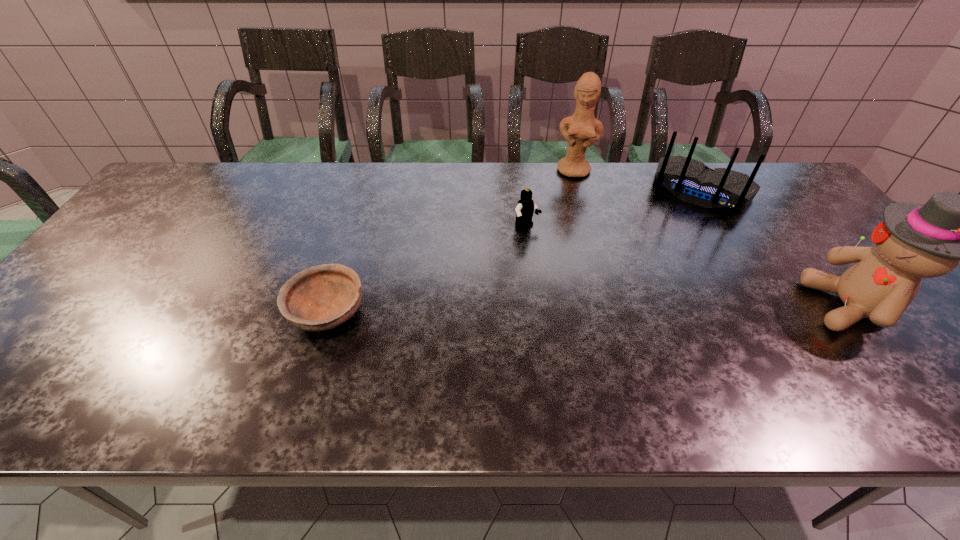
Identify the location of free spot between the fourth tallest object and the leftmost object. (427, 271).

Locate an element on the screen. unoccupied area between the rag_doll and the fourth object from right to left is located at coordinates (688, 267).

Image resolution: width=960 pixels, height=540 pixels. Find the location of `free area in between the rag_doll and the leftmost object`. free area in between the rag_doll and the leftmost object is located at coordinates pyautogui.click(x=588, y=309).

The height and width of the screenshot is (540, 960). Identify the location of free point between the rag_doll and the fourth tallest object. 688,267.

You are a GUI agent. You are given a task and a screenshot of the screen. Output one action in this format:
    pyautogui.click(x=<x>, y=<y>)
    Task: Click on the third closest object to the shortest object
    Image resolution: width=960 pixels, height=540 pixels.
    Given the screenshot: What is the action you would take?
    pyautogui.click(x=690, y=180)

Where is `object identified as the closest to the third shortest object`? The height and width of the screenshot is (540, 960). object identified as the closest to the third shortest object is located at coordinates (585, 130).

Image resolution: width=960 pixels, height=540 pixels. I want to click on vacant space that satisfies the following two spatial constraints: 1. on the back side of the figurine; 2. on the left side of the second shortest object, so click(520, 171).

Locate an element on the screen. vacant point that satisfies the following two spatial constraints: 1. on the front side of the third tallest object; 2. on the left side of the figurine is located at coordinates (581, 191).

In order to click on free location that satisfies the following two spatial constraints: 1. on the front side of the router; 2. on the front-facing side of the rag_doll in this screenshot , I will do `click(771, 306)`.

At what (x,y) coordinates should I click in order to perform the action: click on vacant area that satisfies the following two spatial constraints: 1. on the front side of the third shortest object; 2. on the right side of the third object from left to right. Please return your answer as a coordinate pair (x, y). The width and height of the screenshot is (960, 540). Looking at the image, I should click on point(581,191).